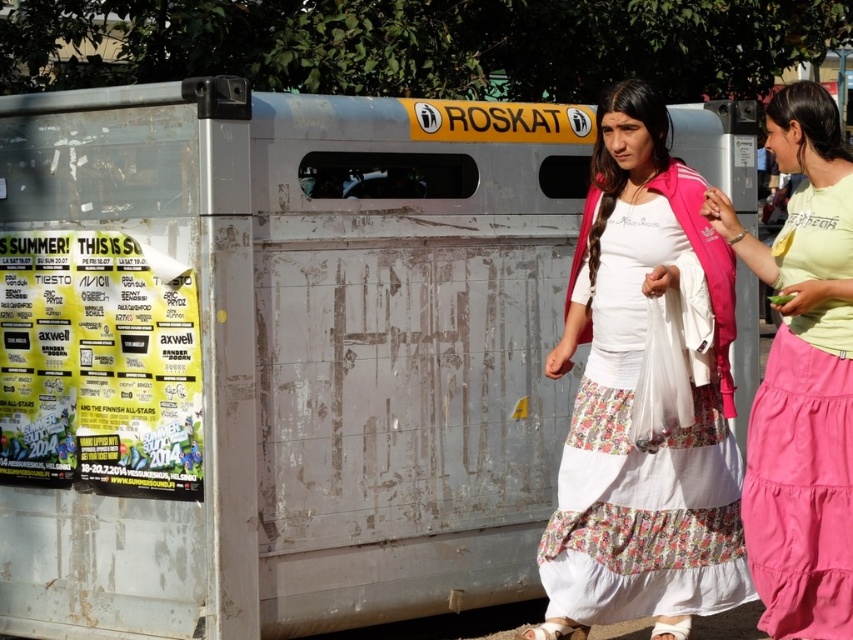
Question: Can you confirm if white cotton dress at center is thinner than light green cotton shirt at right?

Choices:
 (A) no
 (B) yes

Answer: (A)

Question: Which point appears closest to the camera in this image?

Choices:
 (A) (584, 541)
 (B) (799, 406)

Answer: (B)

Question: Where is white cotton dress at center located in relation to light green cotton shirt at right in the image?

Choices:
 (A) right
 (B) left

Answer: (B)

Question: Which object is farther from the camera taking this photo?

Choices:
 (A) light green cotton shirt at right
 (B) white cotton dress at center

Answer: (B)

Question: Is white cotton dress at center wider than light green cotton shirt at right?

Choices:
 (A) yes
 (B) no

Answer: (A)